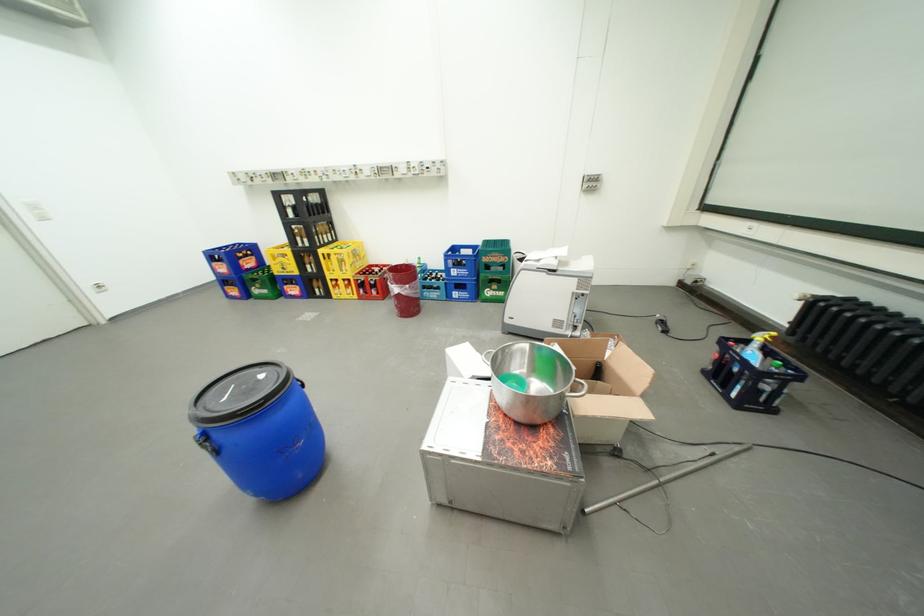
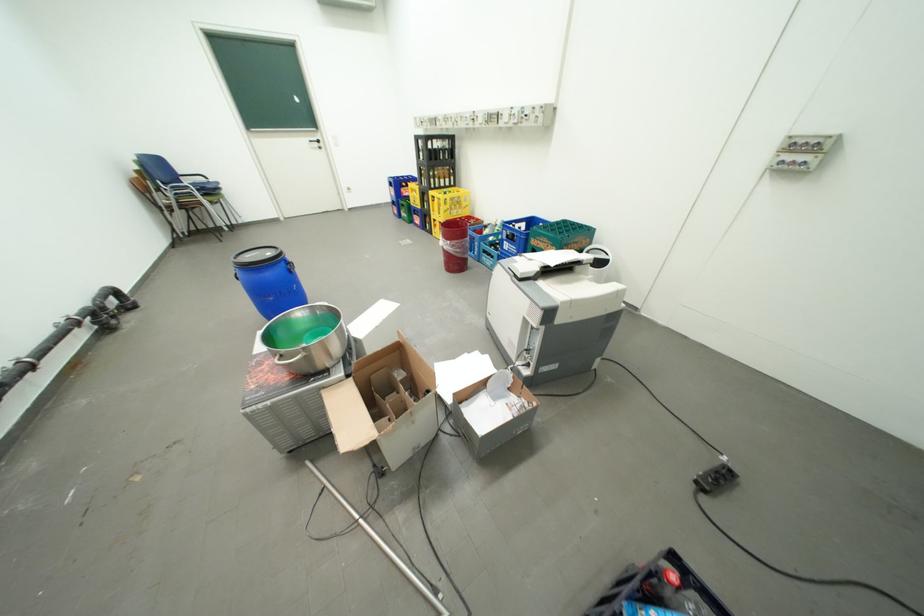
The point at (463,270) is marked in the first image. Where is the corresponding point in the second image?

(516, 244)